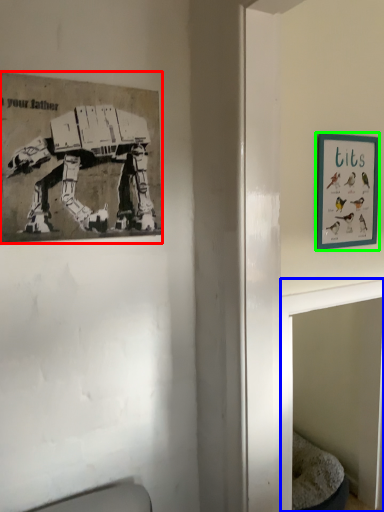
Question: Estimate the real-world distances between objects in this image. Which object is farther from picture frame (highlighted by a red box), table (highlighted by a blue box) or picture frame (highlighted by a green box)?

Choices:
 (A) table
 (B) picture frame

Answer: (B)